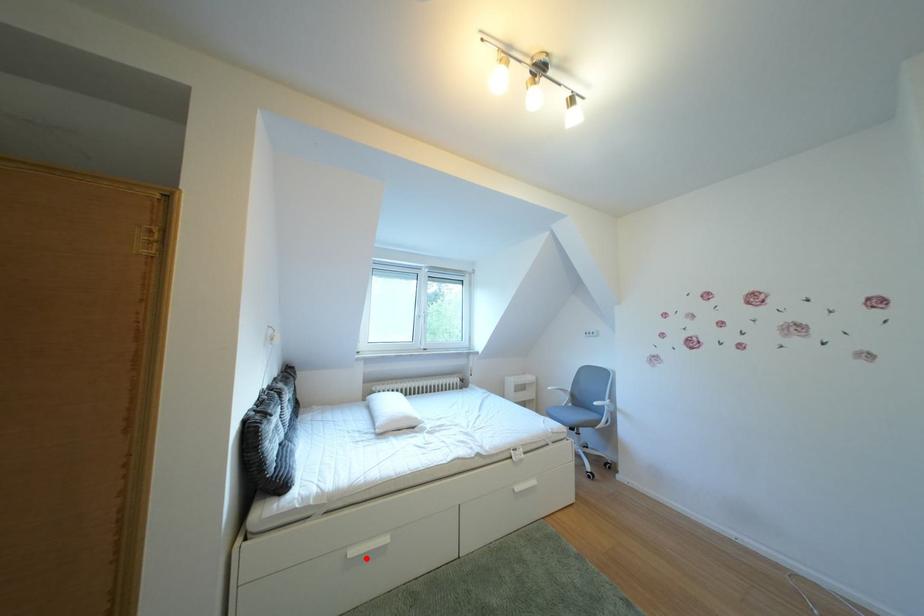
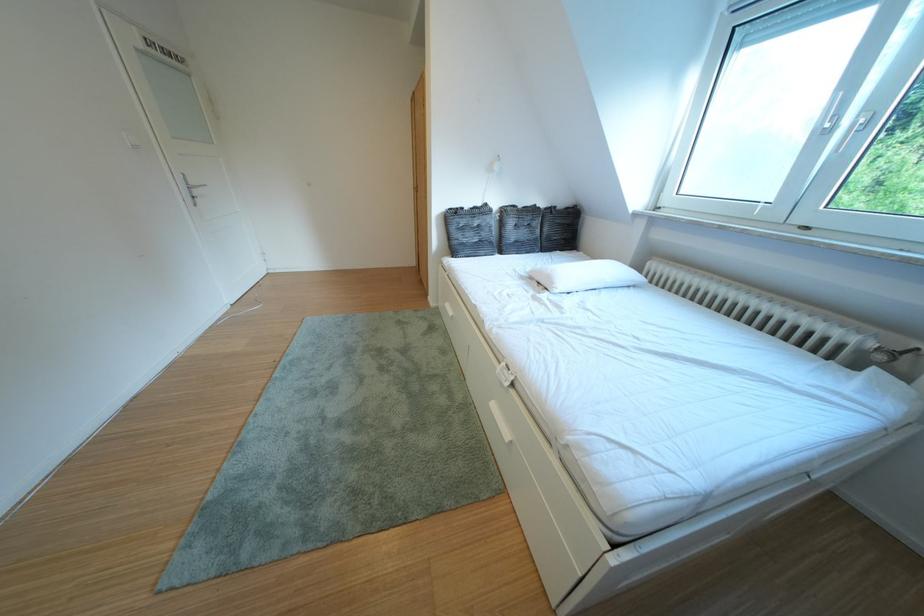
Question: I am providing you with two images of the same scene from different viewpoints. A red point is shown in image1. For the corresponding object point in image2, is it positioned nearer or farther from the camera?

Choices:
 (A) Nearer
 (B) Farther

Answer: (B)